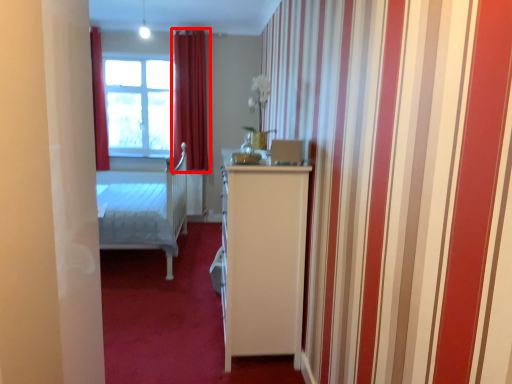
Question: From the image's perspective, what is the correct spatial relationship of curtain (annotated by the red box) in relation to window?

Choices:
 (A) above
 (B) below

Answer: (B)